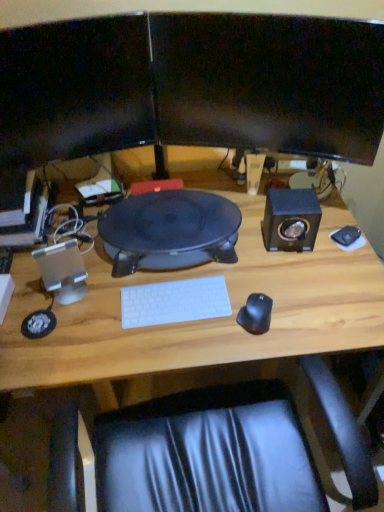
Find the location of `free location in front of black matte mouse at right, positioned as the first mouse in top-to-bottom order`. free location in front of black matte mouse at right, positioned as the first mouse in top-to-bottom order is located at coordinates click(x=346, y=273).